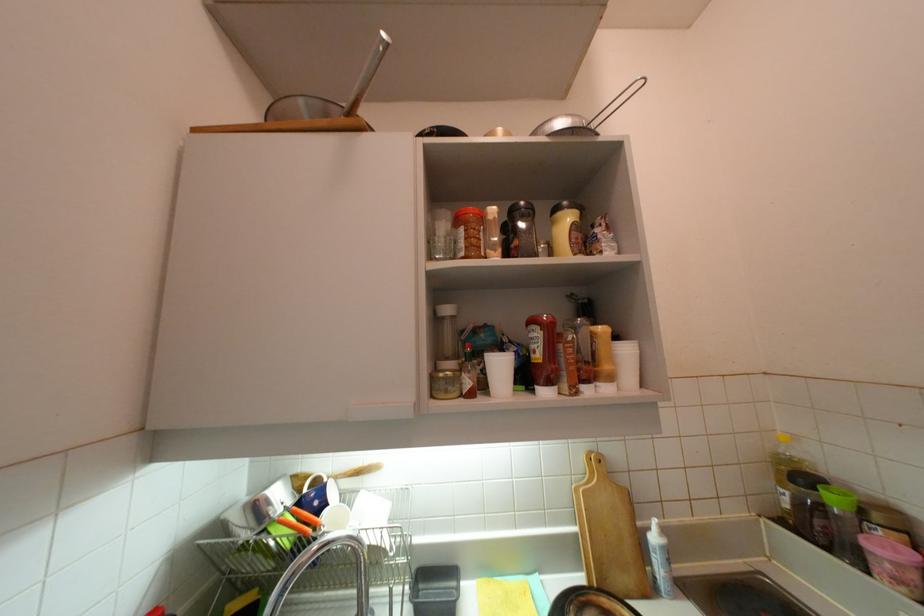
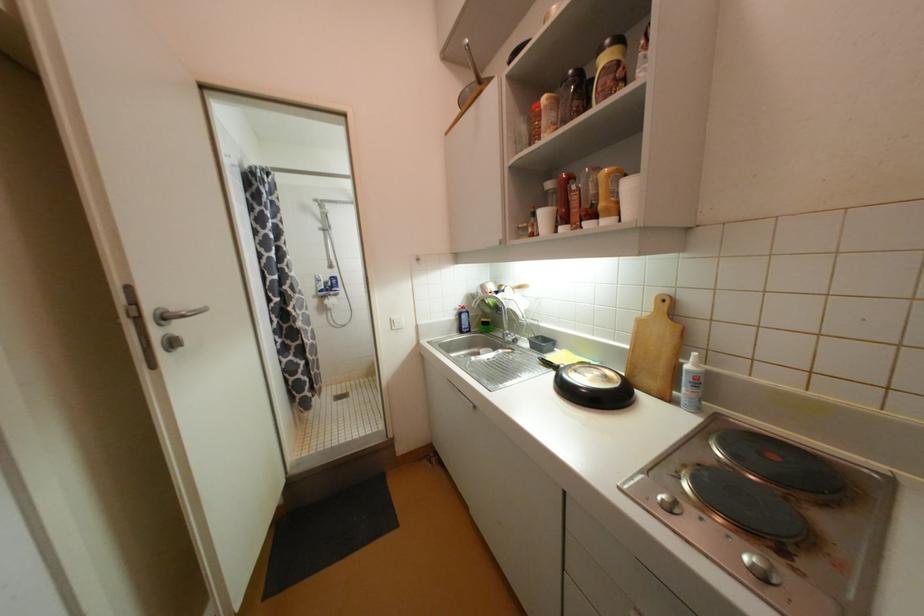
Locate, in the second image, the point that corresponds to pixel 660 540 in the first image.

(693, 368)